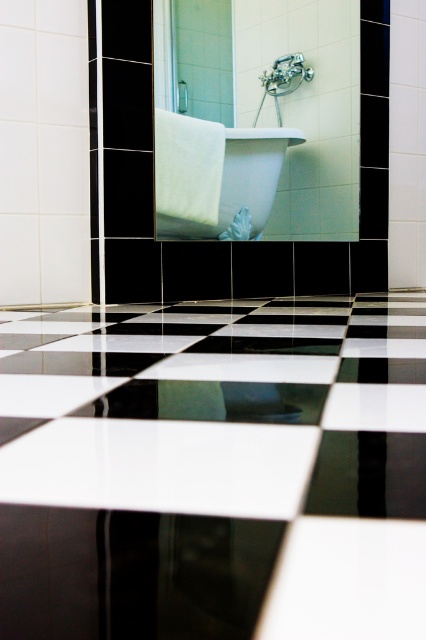
Can you confirm if white glossy bathtub at center is bigger than matte silver shower head at upper center?

Indeed, white glossy bathtub at center has a larger size compared to matte silver shower head at upper center.

Based on the photo, between white glossy bathtub at center and matte silver shower head at upper center, which one has less height?

With less height is matte silver shower head at upper center.

Locate an element on the screen. This screenshot has width=426, height=640. white glossy bathtub at center is located at coordinates (215, 177).